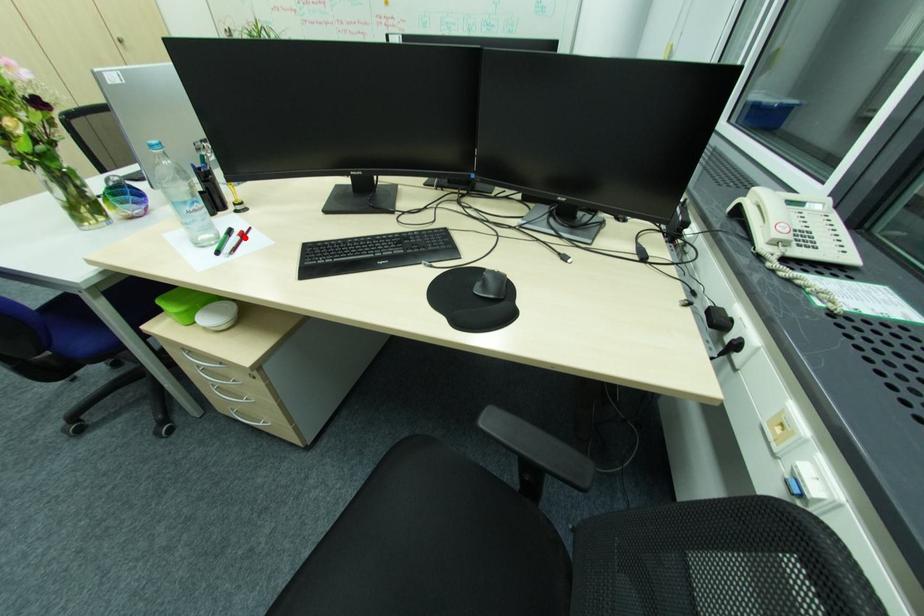
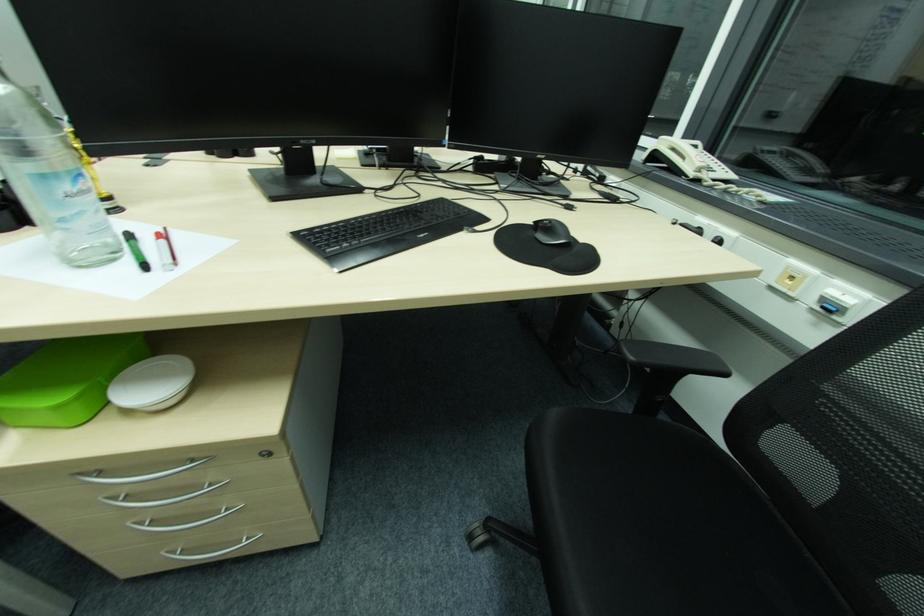
In the second image, find the point that corresponds to the highlighted location in the first image.

(167, 241)